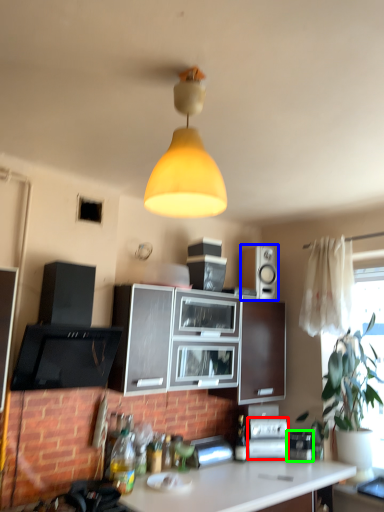
Question: Based on their relative distances, which object is farther from appliance (highlighted by a red box)? Choose from loudspeaker (highlighted by a blue box) and appliance (highlighted by a green box).

Choices:
 (A) loudspeaker
 (B) appliance

Answer: (A)